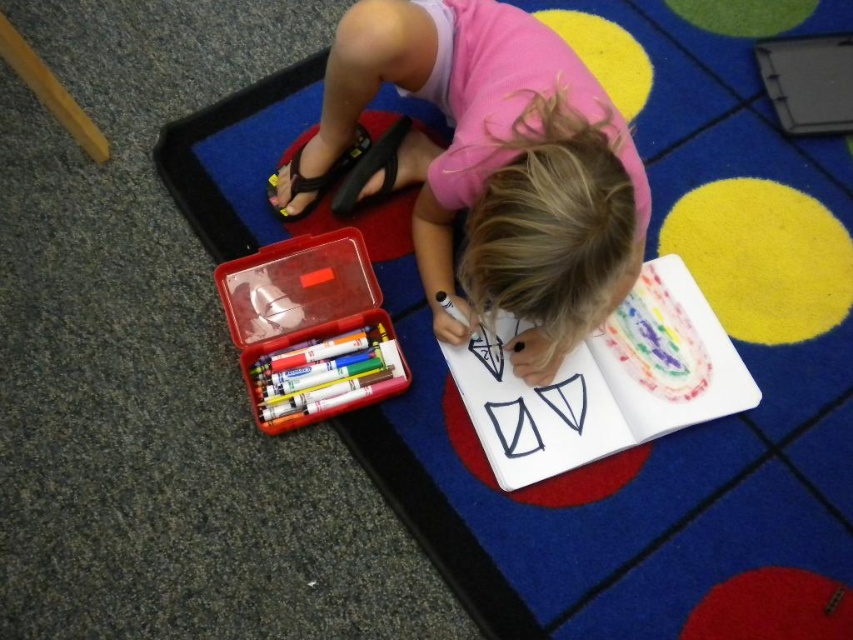
Question: Is the position of pink fabric child at center more distant than that of translucent plastic container at lower left?

Choices:
 (A) yes
 (B) no

Answer: (B)

Question: Which of the following is the closest to the observer?

Choices:
 (A) pink fabric child at center
 (B) translucent plastic container at lower left

Answer: (A)

Question: Which point is closer to the camera?

Choices:
 (A) (500, 150)
 (B) (254, 317)

Answer: (A)

Question: Which point is closer to the camera?

Choices:
 (A) translucent plastic container at lower left
 (B) pink fabric child at center

Answer: (B)

Question: Does pink fabric child at center have a smaller size compared to translucent plastic container at lower left?

Choices:
 (A) yes
 (B) no

Answer: (B)

Question: Does pink fabric child at center lie in front of translucent plastic container at lower left?

Choices:
 (A) yes
 (B) no

Answer: (A)